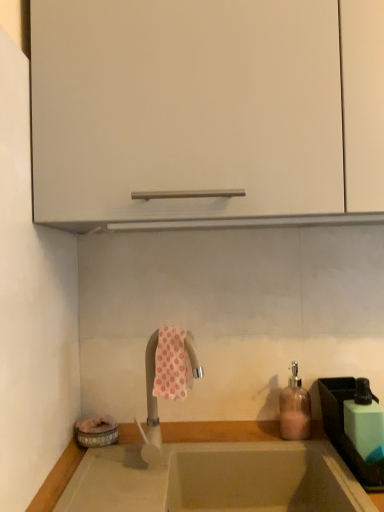
Locate an element on the screen. The image size is (384, 512). vacant space situated on the left part of silver metallic tap at center is located at coordinates (105, 472).